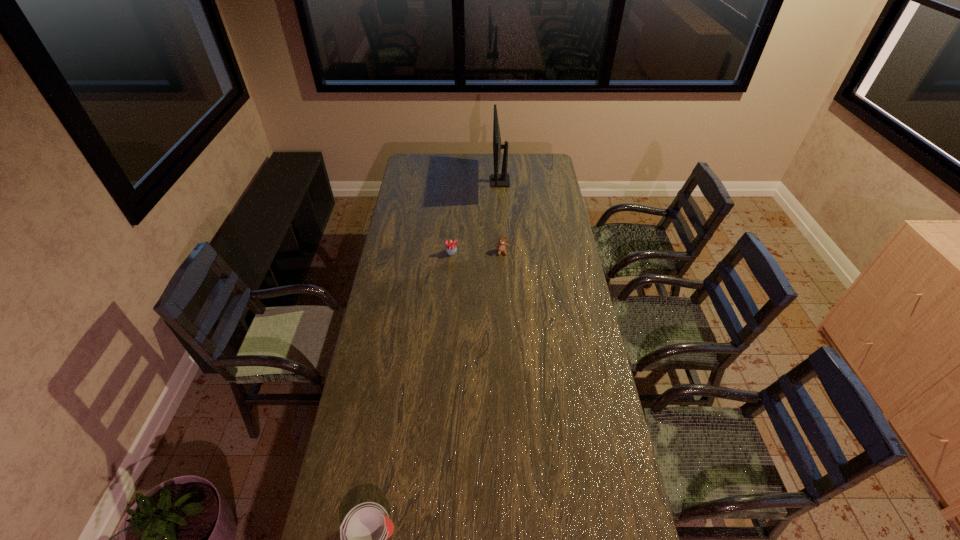
Find the location of a particular element. Image resolution: width=960 pixels, height=540 pixels. vacant space at the far edge of the desktop is located at coordinates (521, 156).

Image resolution: width=960 pixels, height=540 pixels. What are the coordinates of `free space at the left edge` in the screenshot? It's located at (359, 484).

This screenshot has width=960, height=540. What are the coordinates of `free space at the right edge of the desktop` in the screenshot? It's located at (628, 485).

In order to click on free point at the far left corner in this screenshot , I will do `click(422, 153)`.

Find the location of a particular element. Image resolution: width=960 pixels, height=540 pixels. vacant space at the far right corner of the desktop is located at coordinates (529, 155).

Locate an element on the screen. Image resolution: width=960 pixels, height=540 pixels. free area in between the computer monitor and the cupcake is located at coordinates (476, 217).

Identify the location of free area in between the cupcake and the tallest object. This screenshot has width=960, height=540. (476, 217).

Find the location of `vacant area that lies between the third object from right to left and the teddy bear`. vacant area that lies between the third object from right to left and the teddy bear is located at coordinates (477, 252).

Identify the location of vacant area between the teddy bear and the computer monitor. (501, 217).

Locate an element on the screen. This screenshot has width=960, height=540. vacant space in between the teddy bear and the tallest object is located at coordinates (501, 217).